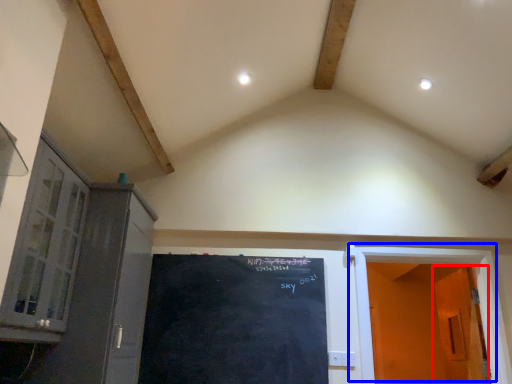
Question: Which object appears closest to the camera in this image, door (highlighted by a red box) or door (highlighted by a blue box)?

Choices:
 (A) door
 (B) door

Answer: (B)